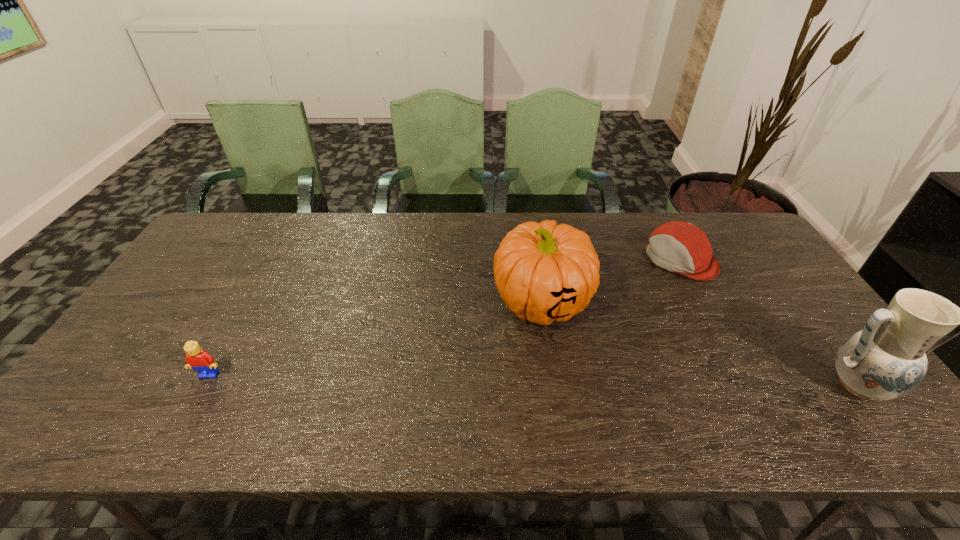
What are the coordinates of `free spot on the desktop that is between the Lego and the pottery and is positioned on the surface of the second object from left to right` in the screenshot? It's located at (480, 379).

You are a GUI agent. You are given a task and a screenshot of the screen. Output one action in this format:
    pyautogui.click(x=<x>, y=<y>)
    Task: Click on the free spot on the desktop that is between the leftmost object and the rightmost object and is positioned on the front-facing side of the third object from left to right
    
    Given the screenshot: What is the action you would take?
    pyautogui.click(x=520, y=380)